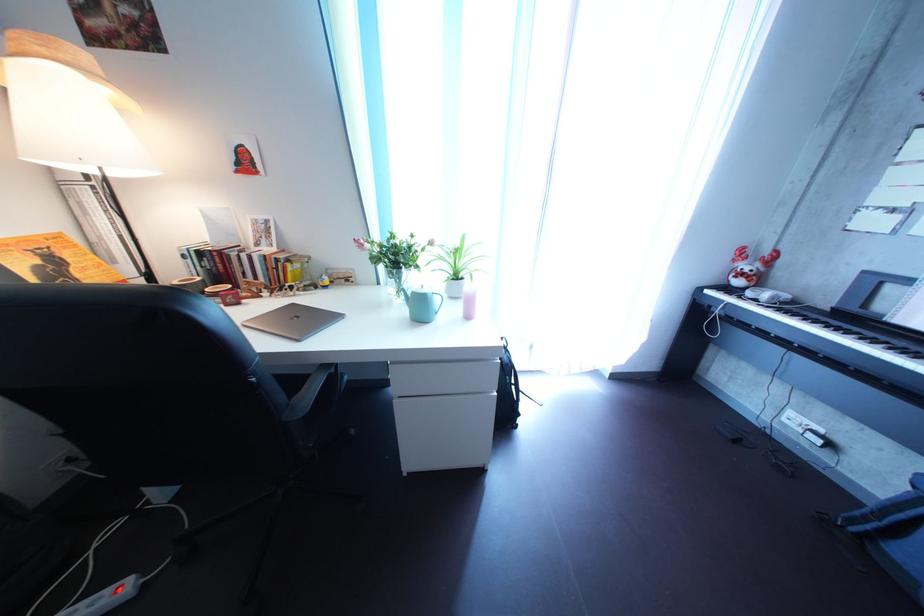
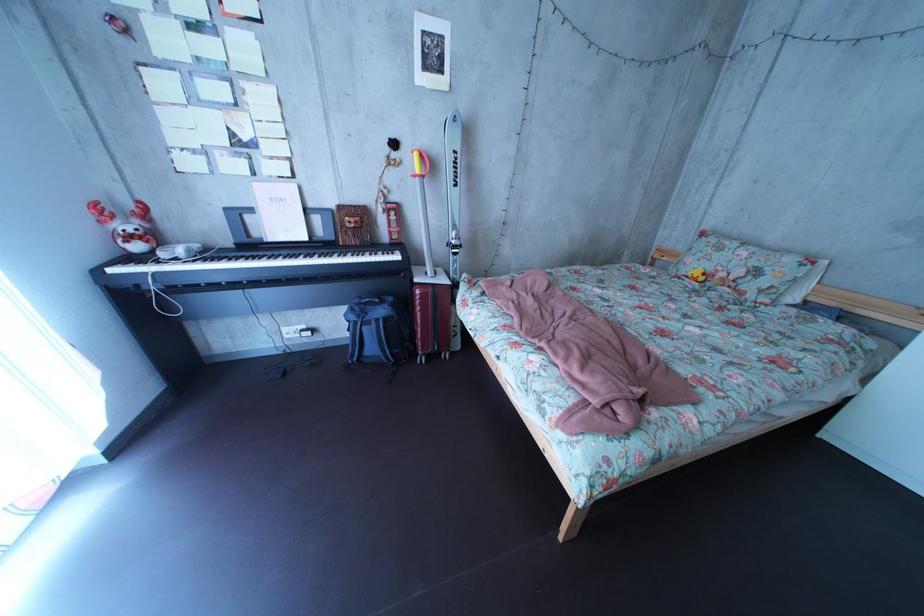
The point at (773, 286) is marked in the first image. Where is the corresponding point in the second image?

(169, 246)